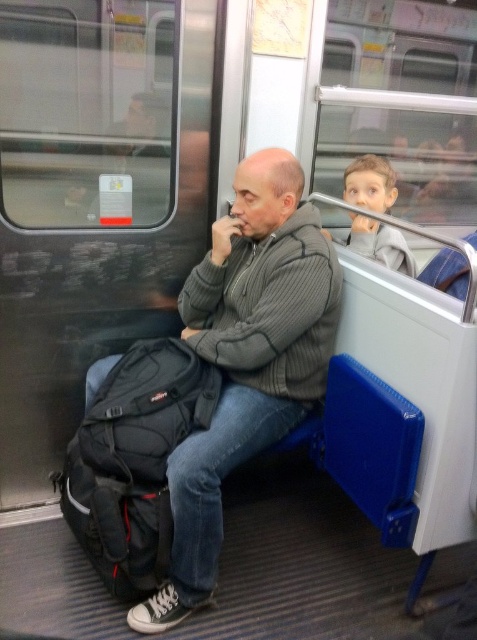
Question: Can you confirm if gray ribbed sweater at center is positioned below smooth gray hoodie at upper right?

Choices:
 (A) yes
 (B) no

Answer: (A)

Question: Based on their relative distances, which object is farther from the black fabric backpack at lower left?

Choices:
 (A) smooth gray hoodie at upper right
 (B) gray ribbed sweater at center

Answer: (A)

Question: Is black fabric backpack at lower left to the right of smooth gray hoodie at upper right from the viewer's perspective?

Choices:
 (A) no
 (B) yes

Answer: (A)

Question: Does gray ribbed sweater at center appear over smooth gray hoodie at upper right?

Choices:
 (A) no
 (B) yes

Answer: (A)

Question: Which point is closer to the camera?

Choices:
 (A) (133, 420)
 (B) (236, 317)

Answer: (A)

Question: Which object appears farthest from the camera in this image?

Choices:
 (A) gray ribbed sweater at center
 (B) black fabric backpack at lower left

Answer: (B)